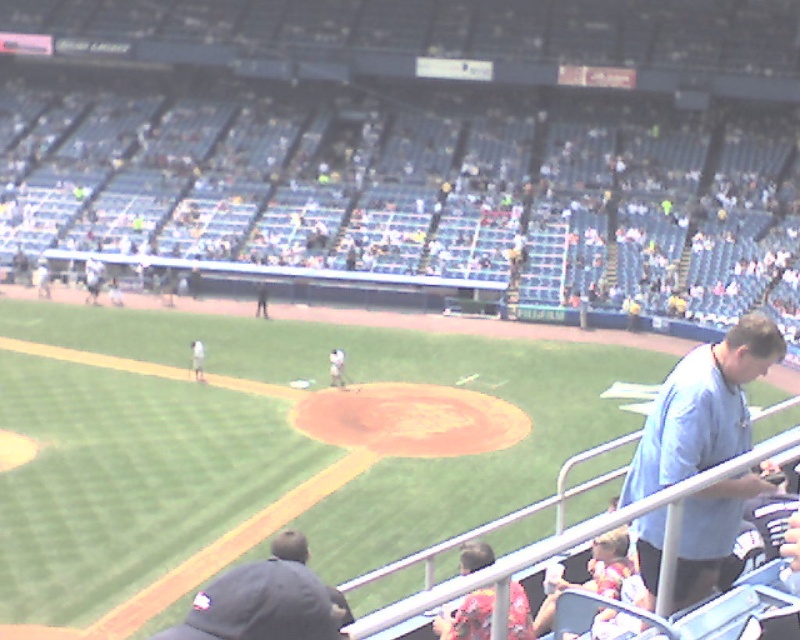
Does light blue shirt at right have a smaller size compared to dark gray baseball cap at lower left?

No.

Based on the photo, does light blue shirt at right have a greater width compared to dark gray baseball cap at lower left?

Yes.

Describe the element at coordinates (702, 408) in the screenshot. The image size is (800, 640). I see `light blue shirt at right` at that location.

Where is `light blue shirt at right`? light blue shirt at right is located at coordinates pos(702,408).

Is the position of light blue seats at upper center more distant than that of light blue shirt at right?

Yes, light blue seats at upper center is behind light blue shirt at right.

Between point (48, 106) and point (733, 529), which one is positioned in front?

Point (733, 529) is in front.

Where is `light blue seats at upper center`? light blue seats at upper center is located at coordinates (413, 195).

Which is more to the left, light blue seats at upper center or dark gray baseball cap at lower left?

light blue seats at upper center

Does light blue seats at upper center come in front of dark gray baseball cap at lower left?

That is False.

Who is more distant from viewer, (64, 204) or (306, 548)?

Point (64, 204)

Locate an element on the screen. Image resolution: width=800 pixels, height=640 pixels. light blue seats at upper center is located at coordinates (413, 195).